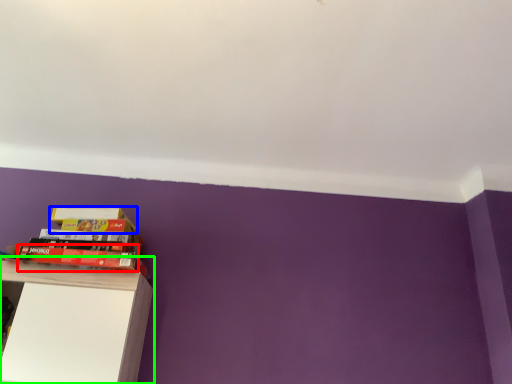
Question: Estimate the real-world distances between objects in this image. Which object is farther from paperback book (highlighted by a red box), paperback book (highlighted by a blue box) or shelf (highlighted by a green box)?

Choices:
 (A) paperback book
 (B) shelf

Answer: (B)